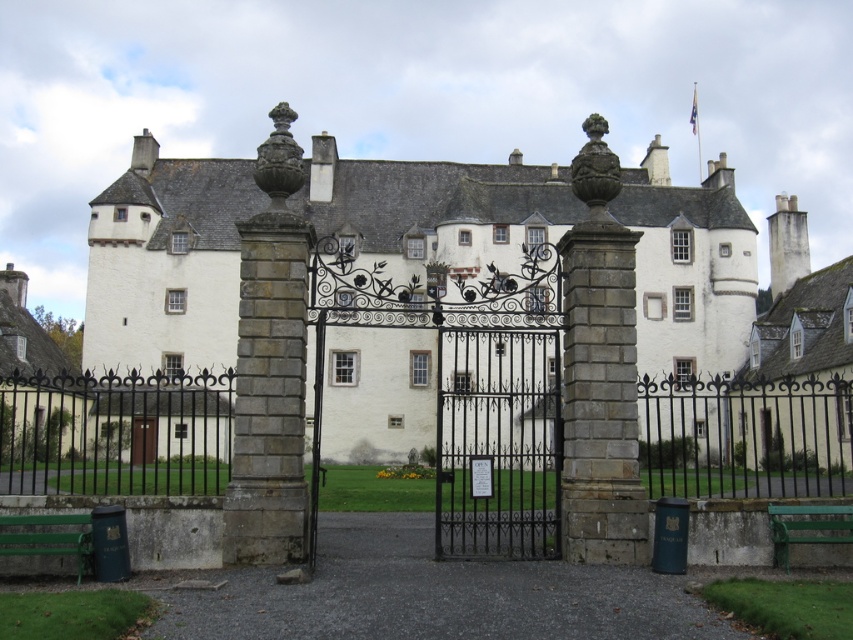
Question: Is green painted wood park bench at lower right in front of brown wooden door at center?

Choices:
 (A) yes
 (B) no

Answer: (A)

Question: Which point is closer to the camera?

Choices:
 (A) brown wooden door at center
 (B) green painted wood park bench at lower right
 (C) green wooden bench at lower left

Answer: (C)

Question: Does green painted wood park bench at lower right have a greater width compared to brown wooden door at center?

Choices:
 (A) no
 (B) yes

Answer: (A)

Question: Which object is farther from the camera taking this photo?

Choices:
 (A) brown wooden door at center
 (B) green painted wood park bench at lower right
 (C) green wooden bench at lower left

Answer: (A)

Question: Is green wooden bench at lower left below brown wooden door at center?

Choices:
 (A) yes
 (B) no

Answer: (B)

Question: Which object appears closest to the camera in this image?

Choices:
 (A) green painted wood park bench at lower right
 (B) brown wooden door at center
 (C) green wooden bench at lower left

Answer: (C)